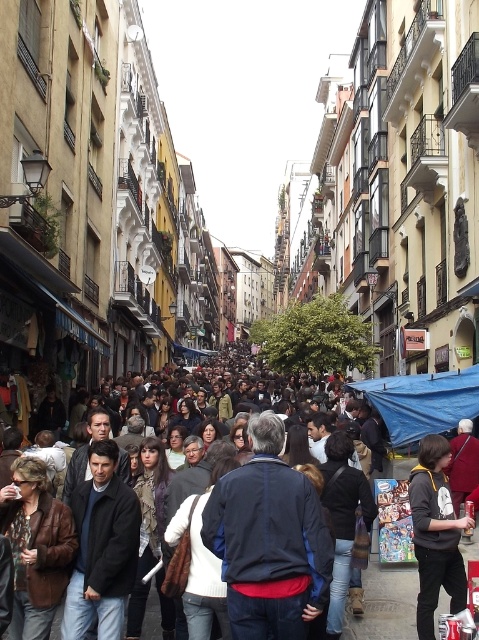
Does blue fabric canopy at center-right have a greater height compared to dark gray fabric crowd at center?

No, blue fabric canopy at center-right is not taller than dark gray fabric crowd at center.

Is blue fabric canopy at center-right positioned before dark gray fabric crowd at center?

That is False.

This screenshot has width=479, height=640. What do you see at coordinates (421, 401) in the screenshot? I see `blue fabric canopy at center-right` at bounding box center [421, 401].

The height and width of the screenshot is (640, 479). In order to click on blue fabric canopy at center-right in this screenshot , I will do `click(421, 401)`.